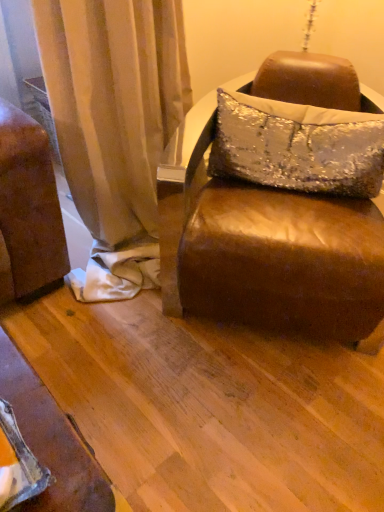
At what (x,y) coordinates should I click in order to perform the action: click on brown leather ottoman at center. Please return your answer as a coordinate pair (x, y). The width and height of the screenshot is (384, 512). Looking at the image, I should click on tap(263, 251).

The image size is (384, 512). Describe the element at coordinates (263, 251) in the screenshot. I see `brown leather ottoman at center` at that location.

Measure the distance between point [288,154] and camera.

The distance of point [288,154] from camera is 1.32 meters.

Locate an element on the screen. This screenshot has width=384, height=512. silver sequined pillow at center is located at coordinates (298, 146).

This screenshot has height=512, width=384. Describe the element at coordinates (298, 146) in the screenshot. I see `silver sequined pillow at center` at that location.

At what (x,y) coordinates should I click in order to perform the action: click on brown leather ottoman at center. Please return your answer as a coordinate pair (x, y). Looking at the image, I should click on (263, 251).

Can you confirm if brown leather ottoman at center is positioned to the left of silver sequined pillow at center?

Yes.

Is brown leather ottoman at center in front of or behind silver sequined pillow at center in the image?

Clearly, brown leather ottoman at center is in front of silver sequined pillow at center.

Does point (214, 310) appear closer or farther from the camera than point (376, 156)?

Clearly, point (214, 310) is more distant from the camera than point (376, 156).

From the image's perspective, is brown leather ottoman at center located above or below silver sequined pillow at center?

From the image's perspective, brown leather ottoman at center appears below silver sequined pillow at center.

From a real-world perspective, which is physically below, brown leather ottoman at center or silver sequined pillow at center?

From a 3D spatial view, brown leather ottoman at center is below.

Does brown leather ottoman at center have a greater width compared to silver sequined pillow at center?

Correct, the width of brown leather ottoman at center exceeds that of silver sequined pillow at center.

Is brown leather ottoman at center shorter than silver sequined pillow at center?

Incorrect, the height of brown leather ottoman at center does not fall short of that of silver sequined pillow at center.

Consider the image. Does brown leather ottoman at center have a larger size compared to silver sequined pillow at center?

Yes.

Which is correct: brown leather ottoman at center is inside silver sequined pillow at center, or outside of it?

brown leather ottoman at center exists outside the volume of silver sequined pillow at center.

Is brown leather ottoman at center not close to silver sequined pillow at center?

No, brown leather ottoman at center is not far from silver sequined pillow at center.

Does brown leather ottoman at center turn towards silver sequined pillow at center?

Yes, brown leather ottoman at center is aimed at silver sequined pillow at center.

How different are the orientations of brown leather ottoman at center and silver sequined pillow at center in degrees?

The angle between the facing direction of brown leather ottoman at center and the facing direction of silver sequined pillow at center is 1.62 degrees.

Find the location of a particular element. The height and width of the screenshot is (512, 384). studio couch in front of the silver sequined pillow at center is located at coordinates (263, 251).

Based on their positions, is silver sequined pillow at center located to the left or right of brown leather ottoman at center?

Based on their positions, silver sequined pillow at center is located to the right of brown leather ottoman at center.

Is silver sequined pillow at center behind brown leather ottoman at center?

Yes, it is behind brown leather ottoman at center.

Does point (383, 120) appear closer or farther from the camera than point (235, 294)?

Point (383, 120) is positioned farther from the camera compared to point (235, 294).

From the image's perspective, which one is positioned lower, silver sequined pillow at center or brown leather ottoman at center?

brown leather ottoman at center, from the image's perspective.

From a real-world perspective, is silver sequined pillow at center on top of brown leather ottoman at center?

Correct, in the physical world, silver sequined pillow at center is higher than brown leather ottoman at center.

Does silver sequined pillow at center have a lesser width compared to brown leather ottoman at center?

Result: Indeed, silver sequined pillow at center has a lesser width compared to brown leather ottoman at center.

Considering the relative sizes of silver sequined pillow at center and brown leather ottoman at center in the image provided, is silver sequined pillow at center taller than brown leather ottoman at center?

Incorrect, the height of silver sequined pillow at center is not larger of that of brown leather ottoman at center.

Considering the relative sizes of silver sequined pillow at center and brown leather ottoman at center in the image provided, is silver sequined pillow at center bigger than brown leather ottoman at center?

Incorrect, silver sequined pillow at center is not larger than brown leather ottoman at center.

Would you say silver sequined pillow at center is inside or outside brown leather ottoman at center?

silver sequined pillow at center can be found inside brown leather ottoman at center.

Are silver sequined pillow at center and brown leather ottoman at center making contact?

silver sequined pillow at center and brown leather ottoman at center are clearly separated.

Does silver sequined pillow at center turn towards brown leather ottoman at center?

Yes, silver sequined pillow at center is facing brown leather ottoman at center.

Identify the location of studio couch below the silver sequined pillow at center (from the image's perspective). This screenshot has height=512, width=384. point(263,251).

In order to click on studio couch located in front of the silver sequined pillow at center in this screenshot , I will do `click(263, 251)`.

There is a brown leather ottoman at center. Find the location of `pillow above it (from a real-world perspective)`. pillow above it (from a real-world perspective) is located at coordinates (298, 146).